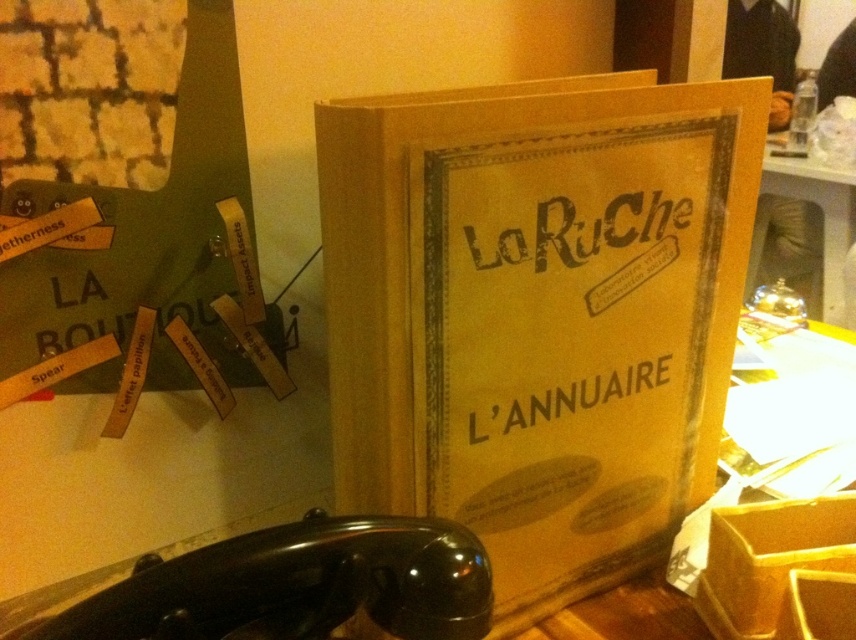
Is point (333, 344) farther from camera compared to point (839, 276)?

No, (333, 344) is closer to viewer.

From the picture: Is yellow cardboard book at center thinner than metallic silver bell at center?

No.

Which is behind, point (565, 236) or point (835, 204)?

The point (835, 204) is behind.

This screenshot has height=640, width=856. Identify the location of yellow cardboard book at center. (538, 312).